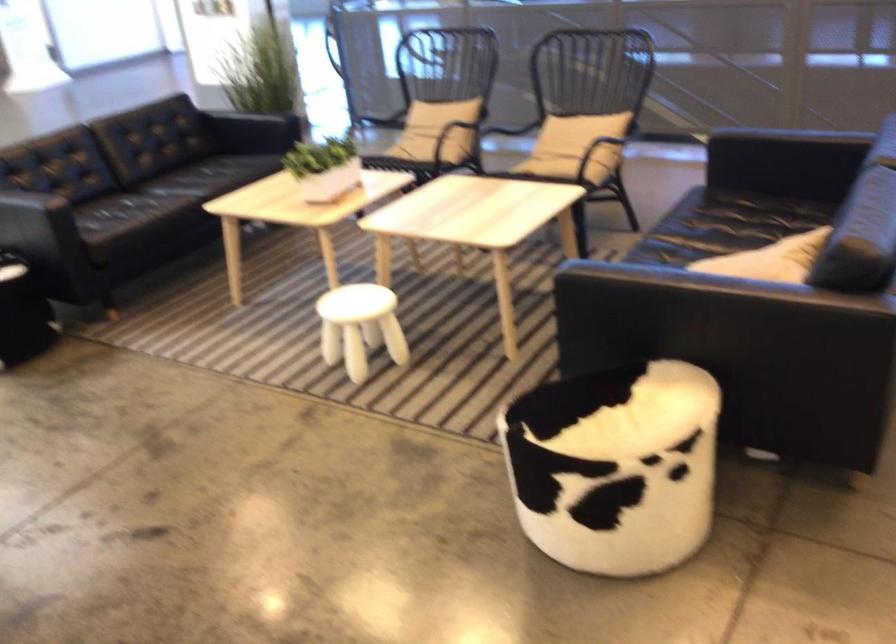
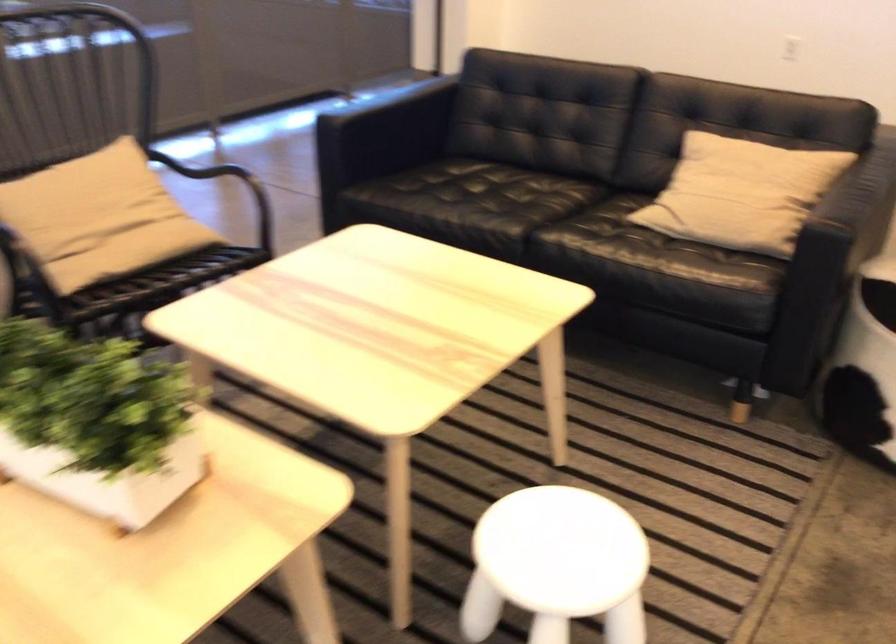
Where in the second image is the point corresponding to (x=358, y=312) from the first image?

(556, 565)